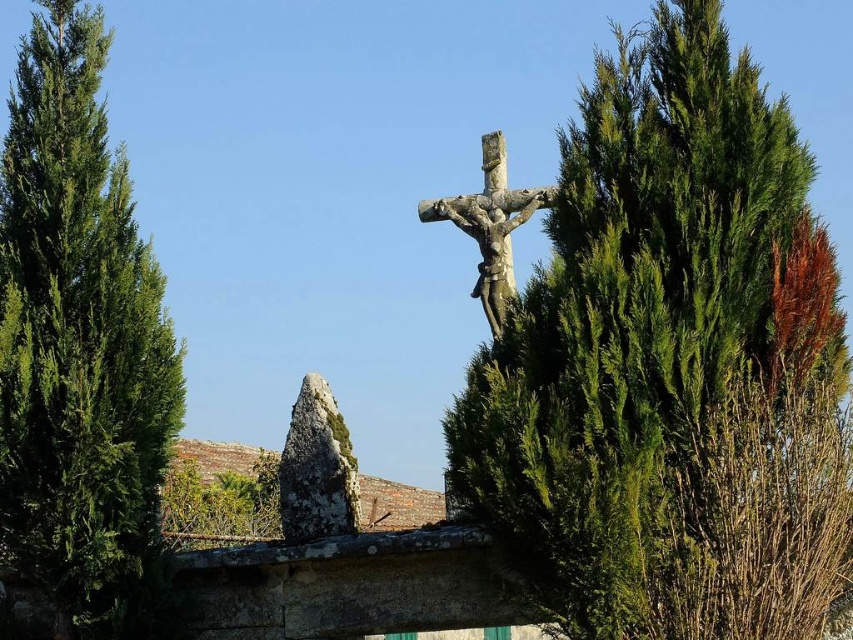
Question: Does green textured tree at upper right appear under green textured tree at left?

Choices:
 (A) no
 (B) yes

Answer: (B)

Question: Which object appears closest to the camera in this image?

Choices:
 (A) green textured tree at left
 (B) green textured tree at upper right
 (C) rough gray stone at center

Answer: (B)

Question: Can you confirm if green textured tree at upper right is wider than rough gray stone at center?

Choices:
 (A) no
 (B) yes

Answer: (B)

Question: Is green textured tree at left above stone statue at center?

Choices:
 (A) yes
 (B) no

Answer: (B)

Question: Which object appears closest to the camera in this image?

Choices:
 (A) stone statue at center
 (B) green textured tree at upper right
 (C) green textured tree at left

Answer: (B)

Question: Which point appears farthest from the camera in this image?

Choices:
 (A) (598, 173)
 (B) (289, 458)
 (C) (489, 232)

Answer: (C)